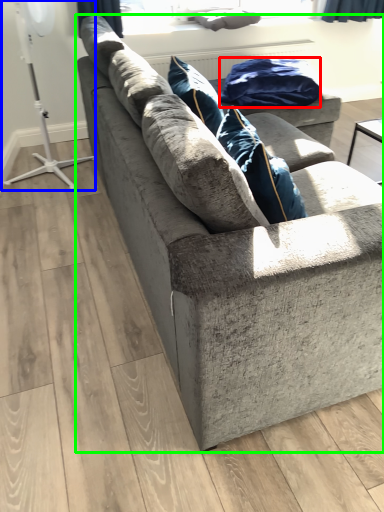
Question: Estimate the real-world distances between objects in this image. Which object is farther from material (highlighted by a red box), fan (highlighted by a blue box) or studio couch (highlighted by a green box)?

Choices:
 (A) fan
 (B) studio couch

Answer: (A)